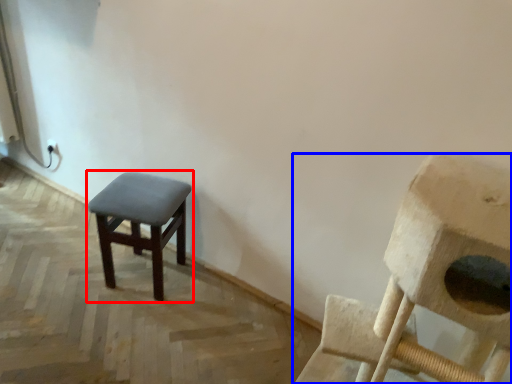
Question: Which point is further to the camera, stool (highlighted by a red box) or chair (highlighted by a blue box)?

Choices:
 (A) stool
 (B) chair

Answer: (A)